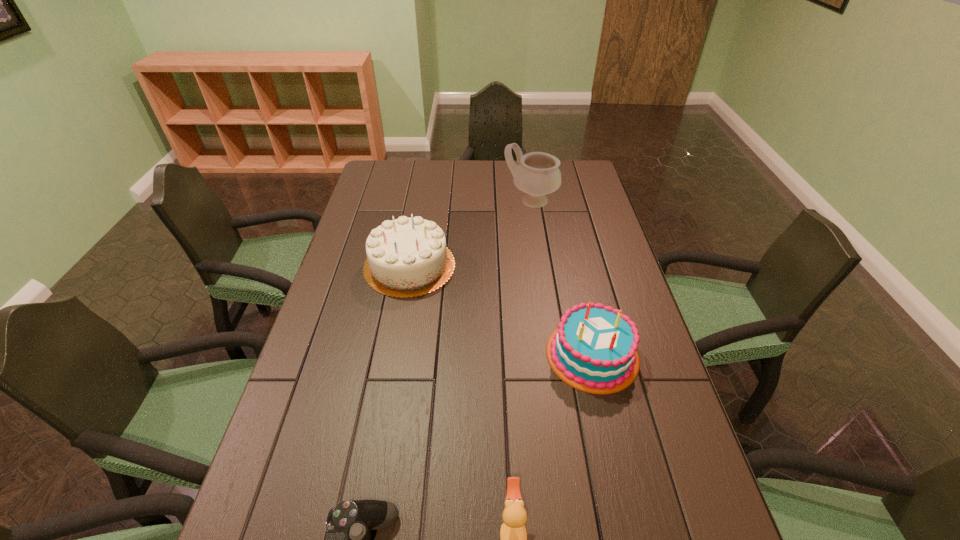
The width and height of the screenshot is (960, 540). Find the location of `object that is at the left edge`. object that is at the left edge is located at coordinates (407, 257).

Image resolution: width=960 pixels, height=540 pixels. In order to click on pottery present at the right edge in this screenshot , I will do `click(538, 174)`.

Locate an element on the screen. birthday cake at the right edge is located at coordinates coord(593,348).

Image resolution: width=960 pixels, height=540 pixels. Identify the location of object that is at the far right corner. (538, 174).

At what (x,y) coordinates should I click in order to perform the action: click on vacant space at the far edge of the desktop. Please return your answer as a coordinate pair (x, y). Looking at the image, I should click on (433, 184).

Where is `vacant area at the left edge of the desktop`? vacant area at the left edge of the desktop is located at coordinates (377, 209).

Locate an element on the screen. Image resolution: width=960 pixels, height=540 pixels. vacant space at the right edge is located at coordinates (596, 210).

Image resolution: width=960 pixels, height=540 pixels. I want to click on free space between the tallest object and the right birthday cake, so click(x=562, y=278).

In order to click on vacant space that's between the third farthest object and the left birthday cake in this screenshot , I will do 501,310.

You are a GUI agent. You are given a task and a screenshot of the screen. Output one action in this format:
    pyautogui.click(x=<x>, y=<y>)
    Task: Click on the vacant space that's between the farthest object and the left birthday cake
    This screenshot has height=540, width=960.
    Given the screenshot: What is the action you would take?
    pyautogui.click(x=470, y=233)